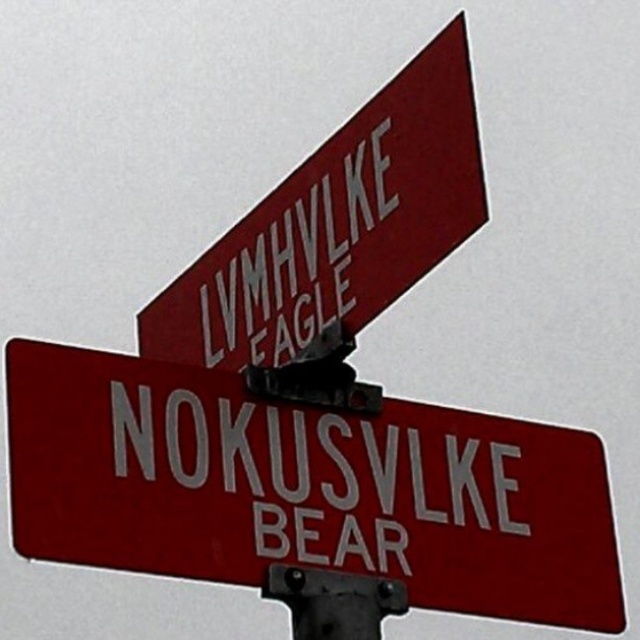
You are a delivery driver who needs to read the text on the white glossy street sign at center. Since the text is upside down, you decide to tilt your head to read it properly. How should you tilt your head to read the text correctly?

To read the upside down text on the white glossy street sign at center correctly, you should tilt your head to the left.

Based on the photo, you are a delivery driver who needs to read the text on both the white glossy street sign at center and the white plastic sign at upper center. Which sign do you think will be easier to read from a distance? Explain your reasoning based on their materials and positions.

The white glossy street sign at center might be easier to read from a distance because glossy surfaces can reflect light more uniformly, potentially reducing glare and improving readability. However, its position at the center might make it more visible compared to the white plastic sign at upper center, which is placed higher up and could be obscured by the pole or other elements. The material and positioning both contribute to readability.